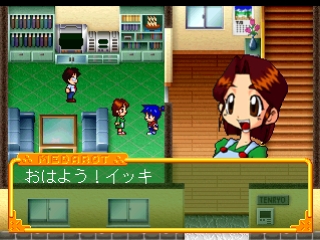
This screenshot has height=240, width=320. In order to click on calendar on wall in this screenshot , I will do `click(244, 18)`.